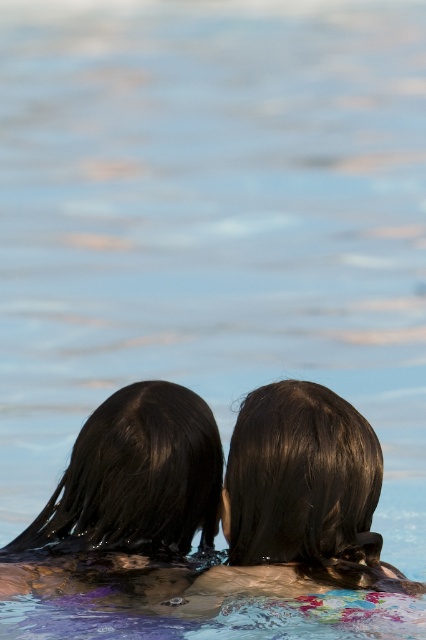
From the picture: Which is above, shiny dark hair at center or wet dark brown hair at center?

shiny dark hair at center

You are a GUI agent. You are given a task and a screenshot of the screen. Output one action in this format:
    pyautogui.click(x=<x>, y=<y>)
    Task: Click on the shiny dark hair at center
    The image size is (426, 640).
    Given the screenshot: What is the action you would take?
    pyautogui.click(x=304, y=509)

At what (x,y) coordinates should I click in order to perform the action: click on shiny dark hair at center. Please return your answer as a coordinate pair (x, y). This screenshot has width=426, height=640. Looking at the image, I should click on (304, 509).